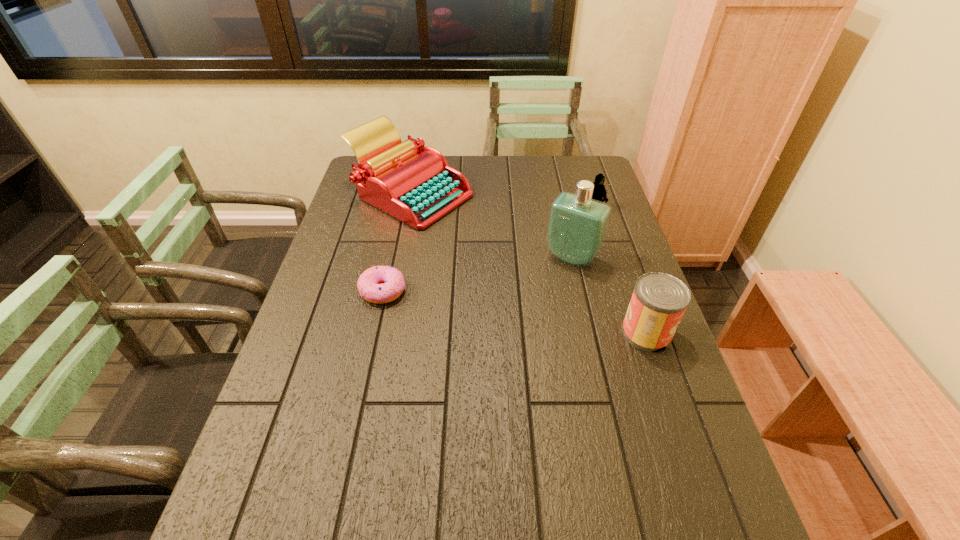
At what (x,y) coordinates should I click in order to perform the action: click on free location that satisfies the following two spatial constraints: 1. on the front side of the perfume; 2. on the left side of the fourth shortest object. Please return your answer as a coordinate pair (x, y). Looking at the image, I should click on (398, 258).

You are a GUI agent. You are given a task and a screenshot of the screen. Output one action in this format:
    pyautogui.click(x=<x>, y=<y>)
    Task: Click on the vacant region that satisfies the following two spatial constraints: 1. on the front side of the typewriter; 2. on the right side of the Lego
    The height and width of the screenshot is (540, 960).
    Given the screenshot: What is the action you would take?
    pyautogui.click(x=408, y=207)

The height and width of the screenshot is (540, 960). I want to click on free space in the image that satisfies the following two spatial constraints: 1. on the front side of the doughnut; 2. on the right side of the can, so click(x=373, y=333).